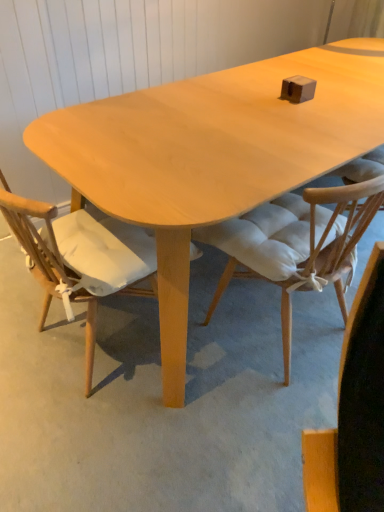
Image resolution: width=384 pixels, height=512 pixels. What do you see at coordinates (80, 258) in the screenshot?
I see `light wood chair at center, which is the 2th chair in right-to-left order` at bounding box center [80, 258].

Measure the distance between point (83, 272) and camera.

The distance of point (83, 272) from camera is 1.29 meters.

At what (x,y) coordinates should I click in order to perform the action: click on light wood chair at center, which is the 2th chair in right-to-left order. Please return your answer as a coordinate pair (x, y). This screenshot has width=384, height=512. Looking at the image, I should click on (80, 258).

What is the approximate width of light wood chair at center, the 1th chair from the left?

It is 58.15 centimeters.

Identify the location of white padded chair at center, placed as the 2th chair when sorted from left to right. (297, 244).

Describe the element at coordinates (297, 244) in the screenshot. I see `white padded chair at center, placed as the 2th chair when sorted from left to right` at that location.

How much space does white padded chair at center, which appears as the 1th chair when viewed from the right, occupy vertically?

The height of white padded chair at center, which appears as the 1th chair when viewed from the right, is 31.11 inches.

Locate an element on the screen. light wood chair at center, which is the 2th chair in right-to-left order is located at coordinates click(x=80, y=258).

Considering the positions of objects white padded chair at center, which appears as the 1th chair when viewed from the right, and light wood chair at center, the 1th chair from the left, in the image provided, who is more to the right, white padded chair at center, which appears as the 1th chair when viewed from the right, or light wood chair at center, the 1th chair from the left,?

white padded chair at center, which appears as the 1th chair when viewed from the right, is more to the right.

Considering the positions of objects white padded chair at center, which appears as the 1th chair when viewed from the right, and light wood chair at center, which is the 2th chair in right-to-left order, in the image provided, who is behind, white padded chair at center, which appears as the 1th chair when viewed from the right, or light wood chair at center, which is the 2th chair in right-to-left order,?

Answer: white padded chair at center, which appears as the 1th chair when viewed from the right, is behind.

Considering the positions of points (343, 204) and (42, 269), is point (343, 204) closer to camera compared to point (42, 269)?

That is True.

From the image's perspective, is white padded chair at center, placed as the 2th chair when sorted from left to right, on top of light wood chair at center, the 1th chair from the left?

Correct, white padded chair at center, placed as the 2th chair when sorted from left to right, appears higher than light wood chair at center, the 1th chair from the left, in the image.

From a real-world perspective, is white padded chair at center, placed as the 2th chair when sorted from left to right, physically located above or below light wood chair at center, the 1th chair from the left?

Clearly, from a real-world perspective, white padded chair at center, placed as the 2th chair when sorted from left to right, is below light wood chair at center, the 1th chair from the left.

Between white padded chair at center, which appears as the 1th chair when viewed from the right, and light wood chair at center, the 1th chair from the left, which one has larger width?

light wood chair at center, the 1th chair from the left, is wider.

Considering the relative sizes of white padded chair at center, which appears as the 1th chair when viewed from the right, and light wood chair at center, which is the 2th chair in right-to-left order, in the image provided, is white padded chair at center, which appears as the 1th chair when viewed from the right, taller than light wood chair at center, which is the 2th chair in right-to-left order,?

Incorrect, the height of white padded chair at center, which appears as the 1th chair when viewed from the right, is not larger of that of light wood chair at center, which is the 2th chair in right-to-left order.

Looking at this image, considering the sizes of white padded chair at center, which appears as the 1th chair when viewed from the right, and light wood chair at center, which is the 2th chair in right-to-left order, in the image, is white padded chair at center, which appears as the 1th chair when viewed from the right, bigger or smaller than light wood chair at center, which is the 2th chair in right-to-left order,?

Clearly, white padded chair at center, which appears as the 1th chair when viewed from the right, is smaller in size than light wood chair at center, which is the 2th chair in right-to-left order.

Consider the image. Is white padded chair at center, placed as the 2th chair when sorted from left to right, completely or partially outside of light wood chair at center, which is the 2th chair in right-to-left order?

Yes.

Is white padded chair at center, placed as the 2th chair when sorted from left to right, next to light wood chair at center, the 1th chair from the left?

No, white padded chair at center, placed as the 2th chair when sorted from left to right, is not beside light wood chair at center, the 1th chair from the left.

Is white padded chair at center, which appears as the 1th chair when viewed from the right, positioned with its back to light wood chair at center, which is the 2th chair in right-to-left order?

No.

What's the angular difference between white padded chair at center, which appears as the 1th chair when viewed from the right, and light wood chair at center, which is the 2th chair in right-to-left order,'s facing directions?

They differ by 90 degrees in their facing directions.

How distant is white padded chair at center, placed as the 2th chair when sorted from left to right, from light wood chair at center, which is the 2th chair in right-to-left order?

A distance of 17.68 inches exists between white padded chair at center, placed as the 2th chair when sorted from left to right, and light wood chair at center, which is the 2th chair in right-to-left order.

You are a GUI agent. You are given a task and a screenshot of the screen. Output one action in this format:
    pyautogui.click(x=<x>, y=<y>)
    Task: Click on the chair beneath the light wood chair at center, the 1th chair from the left (from a real-world perspective)
    Image resolution: width=384 pixels, height=512 pixels.
    Given the screenshot: What is the action you would take?
    pyautogui.click(x=297, y=244)

In the image, is light wood chair at center, which is the 2th chair in right-to-left order, on the left side or the right side of white padded chair at center, placed as the 2th chair when sorted from left to right?

Clearly, light wood chair at center, which is the 2th chair in right-to-left order, is on the left of white padded chair at center, placed as the 2th chair when sorted from left to right, in the image.

Is light wood chair at center, the 1th chair from the left, positioned behind white padded chair at center, placed as the 2th chair when sorted from left to right?

No, light wood chair at center, the 1th chair from the left, is closer to the viewer.

Does point (92, 243) lie in front of point (264, 261)?

No, (92, 243) is behind (264, 261).

From the image's perspective, is light wood chair at center, the 1th chair from the left, on top of white padded chair at center, which appears as the 1th chair when viewed from the right?

No, from the image's perspective, light wood chair at center, the 1th chair from the left, is not above white padded chair at center, which appears as the 1th chair when viewed from the right.

From a real-world perspective, between light wood chair at center, the 1th chair from the left, and white padded chair at center, placed as the 2th chair when sorted from left to right, who is vertically higher?

light wood chair at center, the 1th chair from the left, is physically above.

Which of these two, light wood chair at center, which is the 2th chair in right-to-left order, or white padded chair at center, which appears as the 1th chair when viewed from the right, is thinner?

white padded chair at center, which appears as the 1th chair when viewed from the right.

From the picture: Between light wood chair at center, the 1th chair from the left, and white padded chair at center, placed as the 2th chair when sorted from left to right, which one has less height?

white padded chair at center, placed as the 2th chair when sorted from left to right, is shorter.

Does light wood chair at center, the 1th chair from the left, have a smaller size compared to white padded chair at center, which appears as the 1th chair when viewed from the right?

Actually, light wood chair at center, the 1th chair from the left, might be larger than white padded chair at center, which appears as the 1th chair when viewed from the right.

Is white padded chair at center, which appears as the 1th chair when viewed from the right, surrounded by light wood chair at center, which is the 2th chair in right-to-left order?

→ No, light wood chair at center, which is the 2th chair in right-to-left order, does not contain white padded chair at center, which appears as the 1th chair when viewed from the right.

In the scene shown: Are light wood chair at center, which is the 2th chair in right-to-left order, and white padded chair at center, placed as the 2th chair when sorted from left to right, making contact?

No, light wood chair at center, which is the 2th chair in right-to-left order, is not in contact with white padded chair at center, placed as the 2th chair when sorted from left to right.

Is light wood chair at center, the 1th chair from the left, oriented towards white padded chair at center, placed as the 2th chair when sorted from left to right?

No, light wood chair at center, the 1th chair from the left, is not oriented towards white padded chair at center, placed as the 2th chair when sorted from left to right.

Can you tell me how much light wood chair at center, the 1th chair from the left, and white padded chair at center, which appears as the 1th chair when viewed from the right, differ in facing direction?

They differ by 90 degrees in their facing directions.

Could you measure the distance between light wood chair at center, the 1th chair from the left, and white padded chair at center, which appears as the 1th chair when viewed from the right?

A distance of 17.68 inches exists between light wood chair at center, the 1th chair from the left, and white padded chair at center, which appears as the 1th chair when viewed from the right.

I want to click on chair behind the light wood chair at center, which is the 2th chair in right-to-left order, so click(297, 244).

Find the location of a particular element. Image resolution: width=384 pixels, height=512 pixels. chair below the white padded chair at center, which appears as the 1th chair when viewed from the right (from the image's perspective) is located at coordinates click(80, 258).

Identify the location of chair in front of the white padded chair at center, placed as the 2th chair when sorted from left to right. The width and height of the screenshot is (384, 512). (80, 258).